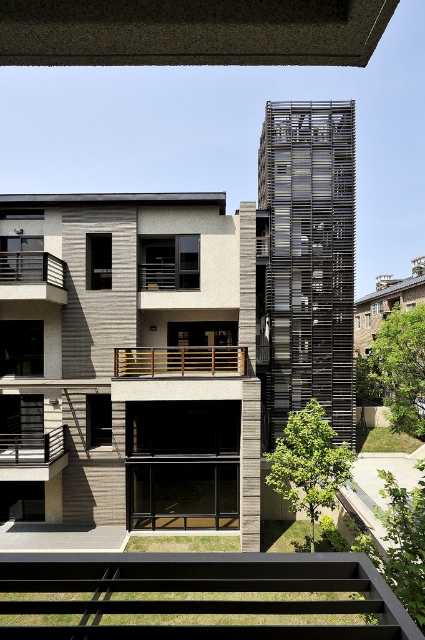
Who is taller, wooden railing at center or brown wooden railing at left?

brown wooden railing at left

Between wooden railing at center and brown wooden railing at left, which one has less height?

Standing shorter between the two is wooden railing at center.

At what (x,y) coordinates should I click in order to perform the action: click on wooden railing at center. Please return your answer as a coordinate pair (x, y). This screenshot has height=640, width=425. Looking at the image, I should click on (180, 360).

Does wooden railing at center lie in front of black metal railing at lower left?

No, wooden railing at center is further to the viewer.

Is point (223, 346) positioned after point (45, 449)?

Yes.

Image resolution: width=425 pixels, height=640 pixels. In order to click on wooden railing at center in this screenshot , I will do `click(180, 360)`.

Is black metal balustrade at lower center taller than brown wooden railing at left?

Indeed, black metal balustrade at lower center has a greater height compared to brown wooden railing at left.

Image resolution: width=425 pixels, height=640 pixels. Describe the element at coordinates (197, 593) in the screenshot. I see `black metal balustrade at lower center` at that location.

Locate an element on the screen. black metal balustrade at lower center is located at coordinates pos(197,593).

Identify the location of black metal balustrade at lower center. (197, 593).